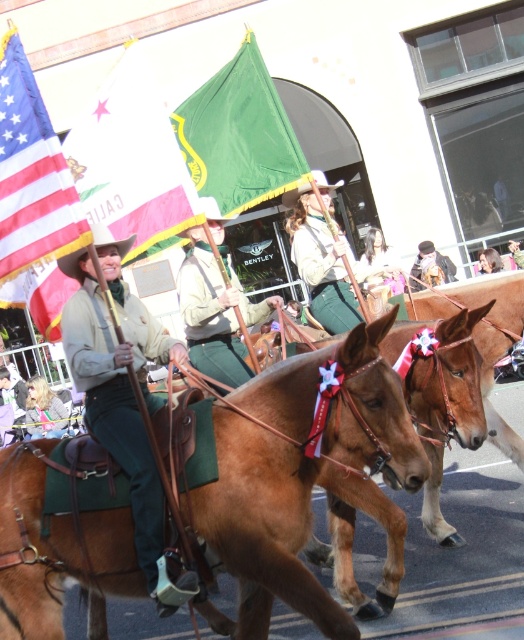
Locate an element on the screen. The image size is (524, 640). american flag at upper left is located at coordinates (132, 161).

Is american flag at upper left positioned in front of green canvas hat at upper center?

Yes, american flag at upper left is in front of green canvas hat at upper center.

What do you see at coordinates (132, 161) in the screenshot? I see `american flag at upper left` at bounding box center [132, 161].

Where is `american flag at upper left`? The width and height of the screenshot is (524, 640). american flag at upper left is located at coordinates (132, 161).

Based on the photo, between leather jacket at center and smooth brown leather hat at upper center, which one has more height?

leather jacket at center

Between point (140, 374) and point (374, 282), which one is positioned behind?

The point (374, 282) is more distant.

Find the location of a particular element. leather jacket at center is located at coordinates (123, 397).

Does smooth brown leather hat at upper center appear on the right side of smooth brown hair at upper center?

No, smooth brown leather hat at upper center is not to the right of smooth brown hair at upper center.

From the picture: Who is positioned more to the right, smooth brown leather hat at upper center or smooth brown hair at upper center?

Positioned to the right is smooth brown hair at upper center.

This screenshot has width=524, height=640. What do you see at coordinates (381, 262) in the screenshot? I see `smooth brown leather hat at upper center` at bounding box center [381, 262].

The width and height of the screenshot is (524, 640). I want to click on smooth brown leather hat at upper center, so click(381, 262).